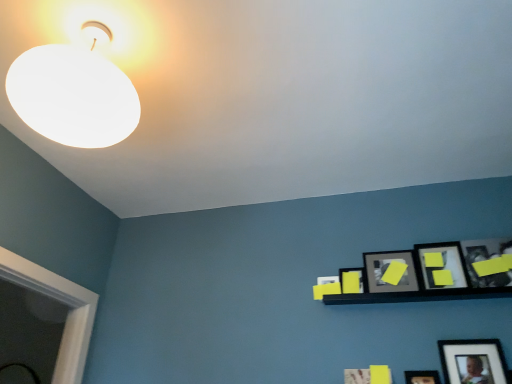
Question: Does white matte lampshade at upper left have a greater width compared to yellow matte picture frame at upper right, placed as the 3th picture frame when sorted from right to left?

Choices:
 (A) no
 (B) yes

Answer: (B)

Question: Can you confirm if white matte lampshade at upper left is positioned to the left of yellow matte picture frame at upper right, placed as the 3th picture frame when sorted from right to left?

Choices:
 (A) no
 (B) yes

Answer: (B)

Question: From the image's perspective, is white matte lampshade at upper left below yellow matte picture frame at upper right, the third picture frame positioned from the left?

Choices:
 (A) yes
 (B) no

Answer: (B)

Question: Is white matte lampshade at upper left turned away from yellow matte picture frame at upper right, the third picture frame positioned from the left?

Choices:
 (A) yes
 (B) no

Answer: (B)

Question: From the image's perspective, would you say white matte lampshade at upper left is positioned over yellow matte picture frame at upper right, placed as the 3th picture frame when sorted from right to left?

Choices:
 (A) yes
 (B) no

Answer: (A)

Question: From a real-world perspective, is yellow matte picture frame at upper right, the fifth picture frame when ordered from right to left, physically located above or below matte black picture frame at upper right, which ranks as the fourth picture frame in right-to-left order?

Choices:
 (A) below
 (B) above

Answer: (A)

Question: Choose the correct answer: Is yellow matte picture frame at upper right, the first picture frame viewed from the left, inside matte black picture frame at upper right, which ranks as the fourth picture frame in right-to-left order, or outside it?

Choices:
 (A) outside
 (B) inside

Answer: (A)

Question: From the image's perspective, is yellow matte picture frame at upper right, the fifth picture frame when ordered from right to left, positioned above or below matte black picture frame at upper right, placed as the 2th picture frame when sorted from left to right?

Choices:
 (A) above
 (B) below

Answer: (B)

Question: Considering the positions of yellow matte picture frame at upper right, the first picture frame viewed from the left, and matte black picture frame at upper right, placed as the 2th picture frame when sorted from left to right, in the image, is yellow matte picture frame at upper right, the first picture frame viewed from the left, taller or shorter than matte black picture frame at upper right, placed as the 2th picture frame when sorted from left to right,?

Choices:
 (A) tall
 (B) short

Answer: (B)

Question: Would you say matte black picture frame at lower right, the second picture frame in the right-to-left sequence, is to the left or to the right of white matte lampshade at upper left in the picture?

Choices:
 (A) right
 (B) left

Answer: (A)

Question: Is point (483, 362) positioned closer to the camera than point (72, 134)?

Choices:
 (A) closer
 (B) farther

Answer: (B)

Question: In the image, is matte black picture frame at lower right, the second picture frame in the right-to-left sequence, positioned in front of or behind white matte lampshade at upper left?

Choices:
 (A) front
 (B) behind

Answer: (B)

Question: Based on their sizes in the image, would you say matte black picture frame at lower right, the second picture frame in the right-to-left sequence, is bigger or smaller than white matte lampshade at upper left?

Choices:
 (A) small
 (B) big

Answer: (A)

Question: From their relative heights in the image, would you say matte black picture frame at upper right, which ranks as the fourth picture frame in right-to-left order, is taller or shorter than white matte lampshade at upper left?

Choices:
 (A) tall
 (B) short

Answer: (B)

Question: Based on their sizes in the image, would you say matte black picture frame at upper right, placed as the 2th picture frame when sorted from left to right, is bigger or smaller than white matte lampshade at upper left?

Choices:
 (A) small
 (B) big

Answer: (A)